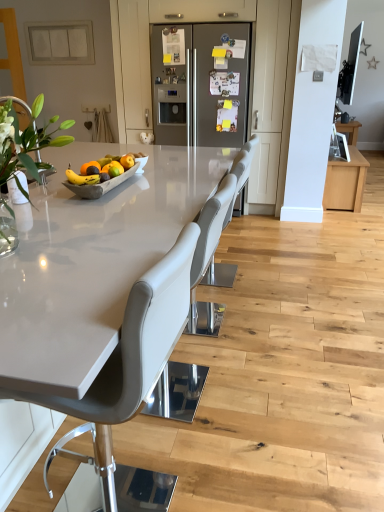
At what (x,y) coordinates should I click in order to perform the action: click on vacant area located to the right-hand side of gray leather chair at center, which is the 3th chair in front-to-back order. Please return your answer as a coordinate pair (x, y). Image resolution: width=384 pixels, height=512 pixels. Looking at the image, I should click on (274, 280).